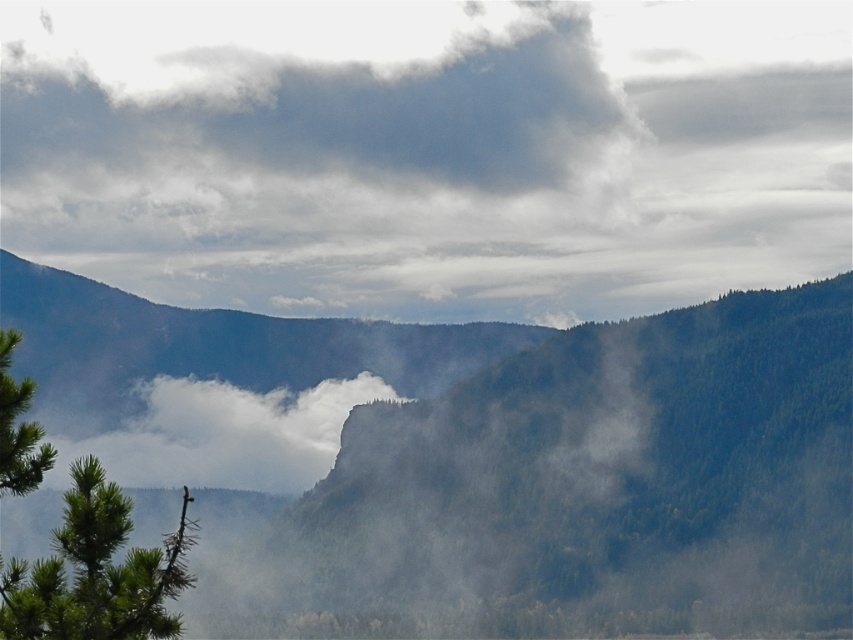
Question: Is gray fluffy cloud at upper center below green forested mountain at center?

Choices:
 (A) yes
 (B) no

Answer: (B)

Question: Which object appears closest to the camera in this image?

Choices:
 (A) green forested mountain at center
 (B) green needle-like tree at left
 (C) white fluffy cloud at center
 (D) gray fluffy cloud at upper center

Answer: (B)

Question: Observing the image, what is the correct spatial positioning of gray fluffy cloud at upper center in reference to green forested mountain at center?

Choices:
 (A) below
 (B) above

Answer: (B)

Question: Which object is positioned closest to the green needle-like tree at left?

Choices:
 (A) gray fluffy cloud at upper center
 (B) green forested mountain at center

Answer: (B)

Question: Which object is positioned farthest from the green forested mountain at center?

Choices:
 (A) gray fluffy cloud at upper center
 (B) green needle-like tree at left

Answer: (B)

Question: Can you confirm if green needle-like tree at left is positioned to the right of white fluffy cloud at center?

Choices:
 (A) yes
 (B) no

Answer: (A)